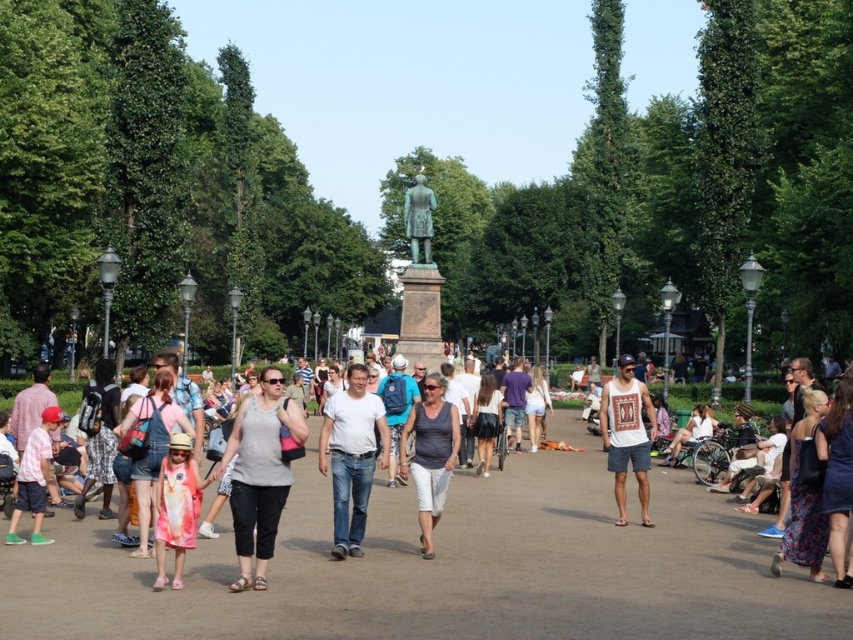
You are at the park and see two dresses in the crowd. The dark blue dress at lower right and the white cotton dress at center. Which one is positioned more to the right side of the park?

The dark blue dress at lower right is positioned more to the right side of the park as it is to the right of the white cotton dress at center.

You are a photographer positioned at the edge of the pathway. You want to capture a photo that includes both the dark blue dress at lower right and the denim shorts at center. Which of the two items should you focus on first to ensure both are in frame?

The dark blue dress at lower right is closer to the viewer than the denim shorts at center, so you should focus on the dark blue dress at lower right first to ensure both are in frame.

You are a photographer planning to capture a group photo of the two dresses in the park scene. The dark blue dress at lower right and the white cotton dress at center are both in your frame. Considering their sizes, which dress should you focus on to ensure it fits well within the camera frame without cropping?

The white cotton dress at center should be focused on since it is smaller in width compared to the dark blue dress at lower right, allowing it to fit better within the camera frame without cropping.